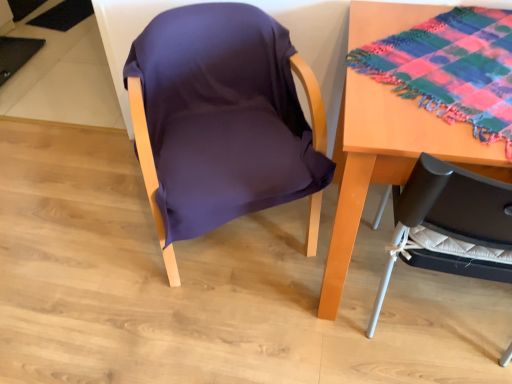
Measure the distance between point (473,78) and camera.

1.06 meters.

Locate an element on the screen. purple fabric chair at center is located at coordinates (223, 121).

Is wooden table at right not close to purple fabric chair at center?

wooden table at right is near purple fabric chair at center, not far away.

Identify the location of chair lying above the wooden table at right (from the image's perspective). (223, 121).

Is wooden table at right turned away from purple fabric chair at center?

No, wooden table at right is not facing the opposite direction of purple fabric chair at center.

Considering the relative sizes of multicolored woven cloth at upper right and wooden table at right in the image provided, is multicolored woven cloth at upper right shorter than wooden table at right?

Correct, multicolored woven cloth at upper right is not as tall as wooden table at right.

From a real-world perspective, relative to wooden table at right, is multicolored woven cloth at upper right vertically above or below?

multicolored woven cloth at upper right is above wooden table at right.

What's the angular difference between multicolored woven cloth at upper right and wooden table at right's facing directions?

139 degrees separate the facing orientations of multicolored woven cloth at upper right and wooden table at right.

From the image's perspective, is multicolored woven cloth at upper right above or below wooden table at right?

Based on their image positions, multicolored woven cloth at upper right is located above wooden table at right.

Which is closer to the camera, (275,129) or (481,87)?

The point (481,87) is in front.

Does purple fabric chair at center turn towards multicolored woven cloth at upper right?

No, purple fabric chair at center is not facing towards multicolored woven cloth at upper right.

Can you confirm if purple fabric chair at center is taller than multicolored woven cloth at upper right?

Yes, purple fabric chair at center is taller than multicolored woven cloth at upper right.

This screenshot has height=384, width=512. In order to click on chair behind the wooden table at right in this screenshot , I will do `click(223, 121)`.

Which is farther, [251,111] or [426,130]?

Positioned behind is point [251,111].

In the scene shown: From the image's perspective, which one is positioned lower, purple fabric chair at center or wooden table at right?

wooden table at right is shown below in the image.

Can you confirm if purple fabric chair at center is positioned to the right of wooden table at right?

No, purple fabric chair at center is not to the right of wooden table at right.

Is multicolored woven cloth at upper right not near purple fabric chair at center?

No.

From a real-world perspective, which is physically above, multicolored woven cloth at upper right or purple fabric chair at center?

From a 3D spatial view, multicolored woven cloth at upper right is above.

Is wooden table at right bigger than multicolored woven cloth at upper right?

Yes.

Considering the relative sizes of wooden table at right and multicolored woven cloth at upper right in the image provided, is wooden table at right wider than multicolored woven cloth at upper right?

In fact, wooden table at right might be narrower than multicolored woven cloth at upper right.

Is point (422, 115) positioned before point (460, 27)?

Yes, it is.

This screenshot has width=512, height=384. In the image, there is a multicolored woven cloth at upper right. Identify the location of table below it (from the image's perspective). (388, 161).

At what (x,y) coordinates should I click in order to perform the action: click on table beneath the purple fabric chair at center (from a real-world perspective). Please return your answer as a coordinate pair (x, y). Image resolution: width=512 pixels, height=384 pixels. Looking at the image, I should click on click(388, 161).

The height and width of the screenshot is (384, 512). In order to click on blanket located behind the wooden table at right in this screenshot , I will do `click(451, 68)`.

Considering their positions, is wooden table at right positioned further to multicolored woven cloth at upper right than purple fabric chair at center?

purple fabric chair at center is positioned further to the anchor multicolored woven cloth at upper right.

Considering their positions, is purple fabric chair at center positioned further to multicolored woven cloth at upper right than wooden table at right?

purple fabric chair at center is further to multicolored woven cloth at upper right.

Which object lies nearer to the anchor point purple fabric chair at center, wooden table at right or multicolored woven cloth at upper right?

wooden table at right is closer to purple fabric chair at center.

Looking at the image, which one is located further to wooden table at right, purple fabric chair at center or multicolored woven cloth at upper right?

purple fabric chair at center lies further to wooden table at right than the other object.

When comparing their distances from wooden table at right, does multicolored woven cloth at upper right or purple fabric chair at center seem closer?

The object closer to wooden table at right is multicolored woven cloth at upper right.

Estimate the real-world distances between objects in this image. Which object is closer to purple fabric chair at center, multicolored woven cloth at upper right or wooden table at right?

Among the two, wooden table at right is located nearer to purple fabric chair at center.

Locate an element on the screen. table between purple fabric chair at center and multicolored woven cloth at upper right from left to right is located at coordinates (388, 161).